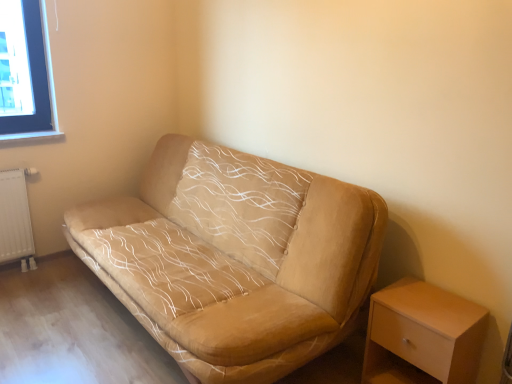
Question: Is beige fabric couch at center to the right of white matte wooden table at lower right from the viewer's perspective?

Choices:
 (A) yes
 (B) no

Answer: (B)

Question: Is beige fabric couch at center smaller than white matte wooden table at lower right?

Choices:
 (A) yes
 (B) no

Answer: (B)

Question: Is white matte wooden table at lower right a part of beige fabric couch at center?

Choices:
 (A) yes
 (B) no

Answer: (B)

Question: Is beige fabric couch at center shorter than white matte wooden table at lower right?

Choices:
 (A) yes
 (B) no

Answer: (B)

Question: Is beige fabric couch at center to the left of white matte wooden table at lower right from the viewer's perspective?

Choices:
 (A) yes
 (B) no

Answer: (A)

Question: Is white matte wooden table at lower right taller or shorter than beige fabric couch at center?

Choices:
 (A) tall
 (B) short

Answer: (B)

Question: Based on their positions, is white matte wooden table at lower right located to the left or right of beige fabric couch at center?

Choices:
 (A) right
 (B) left

Answer: (A)

Question: From the image's perspective, is white matte wooden table at lower right above or below beige fabric couch at center?

Choices:
 (A) above
 (B) below

Answer: (B)

Question: Is point (395, 311) closer or farther from the camera than point (167, 256)?

Choices:
 (A) farther
 (B) closer

Answer: (B)

Question: Considering the positions of point (18, 256) and point (345, 271), is point (18, 256) closer or farther from the camera than point (345, 271)?

Choices:
 (A) farther
 (B) closer

Answer: (A)

Question: In terms of size, does white textured radiator at lower left appear bigger or smaller than beige fabric couch at center?

Choices:
 (A) small
 (B) big

Answer: (A)

Question: From a real-world perspective, is white textured radiator at lower left above or below beige fabric couch at center?

Choices:
 (A) below
 (B) above

Answer: (A)

Question: Considering the positions of white textured radiator at lower left and beige fabric couch at center in the image, is white textured radiator at lower left taller or shorter than beige fabric couch at center?

Choices:
 (A) tall
 (B) short

Answer: (B)

Question: Based on their sizes in the image, would you say white matte wooden table at lower right is bigger or smaller than white textured radiator at lower left?

Choices:
 (A) big
 (B) small

Answer: (A)

Question: From the image's perspective, relative to white textured radiator at lower left, is white matte wooden table at lower right above or below?

Choices:
 (A) above
 (B) below

Answer: (B)